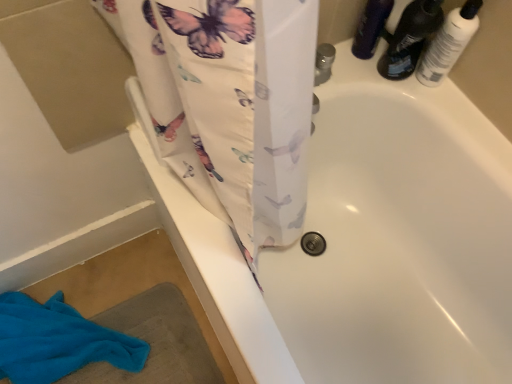
Question: From the image's perspective, is blue cotton towel at lower left on translucent plastic bottles at upper right?

Choices:
 (A) no
 (B) yes

Answer: (A)

Question: Does blue cotton towel at lower left have a greater width compared to translucent plastic bottles at upper right?

Choices:
 (A) yes
 (B) no

Answer: (A)

Question: Is blue cotton towel at lower left positioned behind translucent plastic bottles at upper right?

Choices:
 (A) no
 (B) yes

Answer: (B)

Question: Would you say blue cotton towel at lower left contains translucent plastic bottles at upper right?

Choices:
 (A) yes
 (B) no

Answer: (B)

Question: Is blue cotton towel at lower left smaller than translucent plastic bottles at upper right?

Choices:
 (A) yes
 (B) no

Answer: (B)

Question: Considering the positions of translucent plastic bottles at upper right and white glossy bottle at upper right, which is counted as the second toiletry, starting from the left, in the image, is translucent plastic bottles at upper right taller or shorter than white glossy bottle at upper right, which is counted as the second toiletry, starting from the left,?

Choices:
 (A) short
 (B) tall

Answer: (B)

Question: Is translucent plastic bottles at upper right inside or outside of white glossy bottle at upper right, positioned as the first toiletry in right-to-left order?

Choices:
 (A) inside
 (B) outside

Answer: (B)

Question: Based on their positions, is translucent plastic bottles at upper right located to the left or right of white glossy bottle at upper right, which is counted as the second toiletry, starting from the left?

Choices:
 (A) left
 (B) right

Answer: (A)

Question: Is point (419, 26) positioned closer to the camera than point (466, 18)?

Choices:
 (A) closer
 (B) farther

Answer: (B)

Question: Considering the positions of point (15, 306) and point (388, 31), is point (15, 306) closer or farther from the camera than point (388, 31)?

Choices:
 (A) farther
 (B) closer

Answer: (A)

Question: From a real-world perspective, is blue cotton towel at lower left positioned above or below translucent plastic bottles at upper right?

Choices:
 (A) above
 (B) below

Answer: (B)

Question: From the image's perspective, is blue cotton towel at lower left above or below translucent plastic bottles at upper right?

Choices:
 (A) above
 (B) below

Answer: (B)

Question: Considering the relative positions of blue cotton towel at lower left and translucent plastic bottles at upper right in the image provided, is blue cotton towel at lower left to the left or to the right of translucent plastic bottles at upper right?

Choices:
 (A) right
 (B) left

Answer: (B)

Question: Is matte black bottle at upper right, the first toiletry from the left, in front of or behind translucent plastic bottles at upper right in the image?

Choices:
 (A) front
 (B) behind

Answer: (B)

Question: From a real-world perspective, is matte black bottle at upper right, the first toiletry from the left, positioned above or below translucent plastic bottles at upper right?

Choices:
 (A) above
 (B) below

Answer: (B)